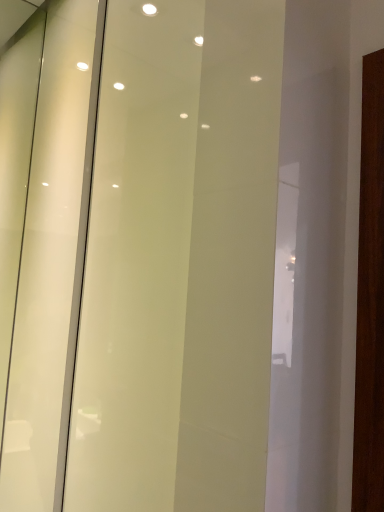
Question: Should I look upward or downward to see transparent glass screen door at center?

Choices:
 (A) up
 (B) down

Answer: (A)